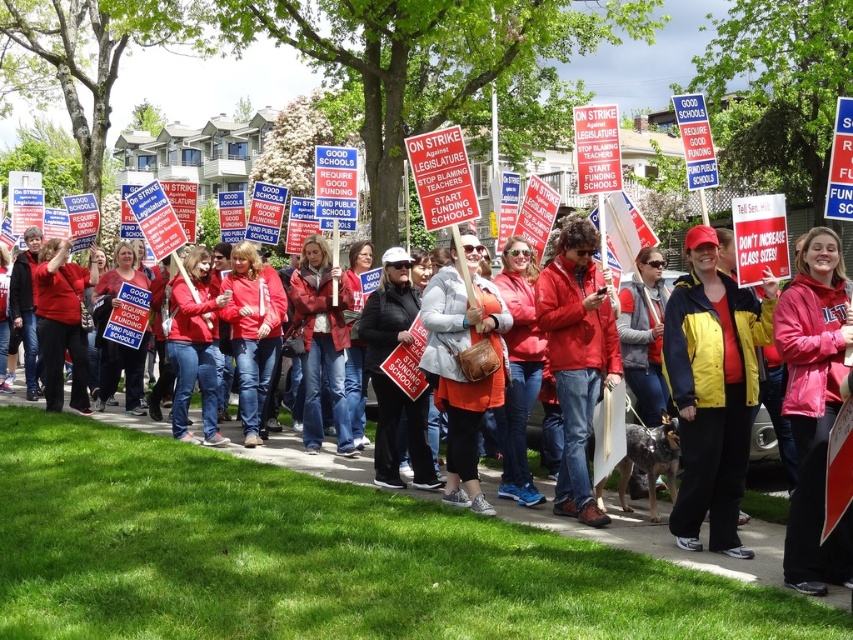
You are a photographer trying to capture a clear shot of the yellow jacket at center and the pink fabric jacket at center. Which jacket should you focus on first to ensure it appears in the foreground of your photo?

The yellow jacket at center should be focused on first because it is located above the pink fabric jacket at center, placing it closer to the foreground.